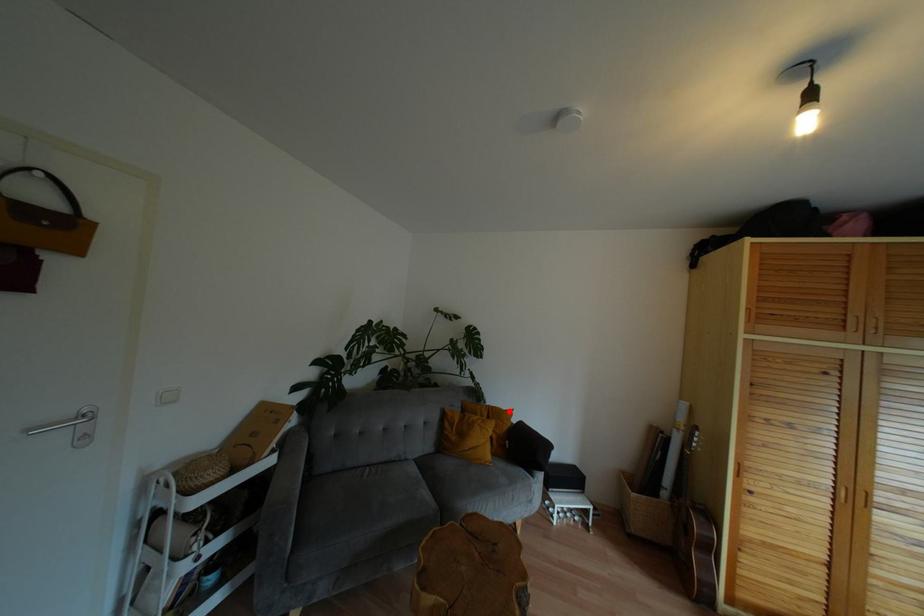
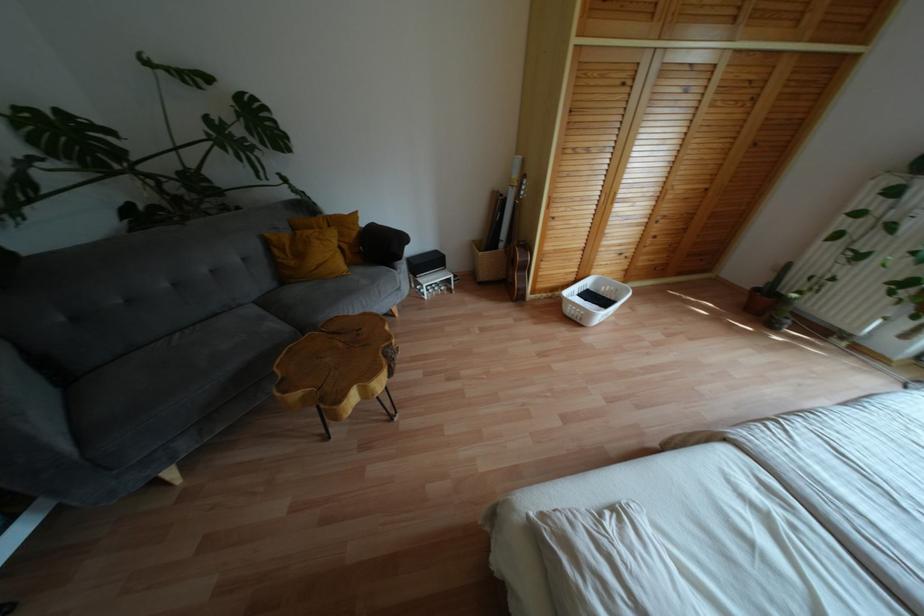
Where in the second image is the point corresponding to the highlighted location from the first image?

(354, 214)